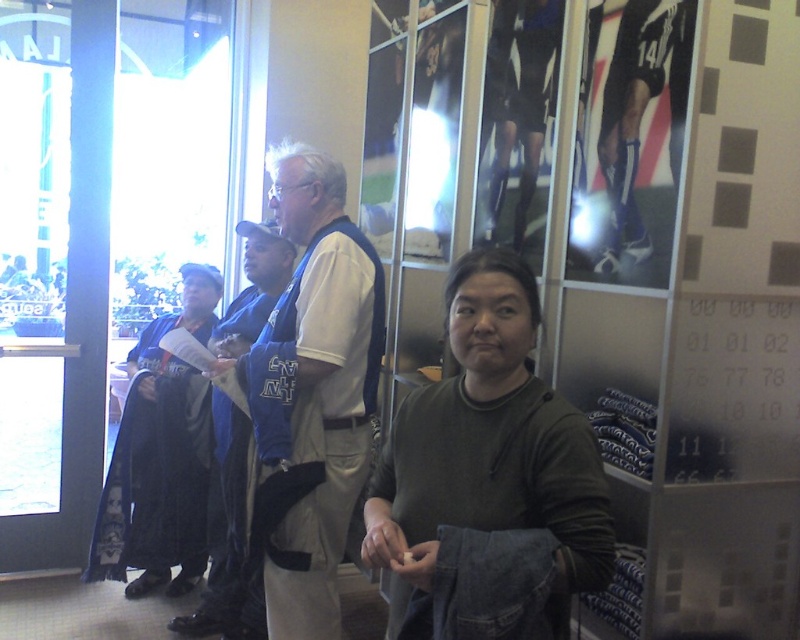
You are standing in the sports exhibit and notice the dark green sweater at center. Can you determine its exact position using the coordinate system provided?

The dark green sweater at center is located at point 0.700 in the x coordinate and 0.613 in the y coordinate.

You are a photographer trying to capture a group photo of the light beige fabric shirt at center and the black fabric robe at left. If you want to ensure both subjects are fully visible in the frame, which subject should you position closer to the camera to avoid cropping?

The light beige fabric shirt at center should be positioned closer to the camera because it might be wider than the black fabric robe at left, ensuring both fit within the frame without cropping.